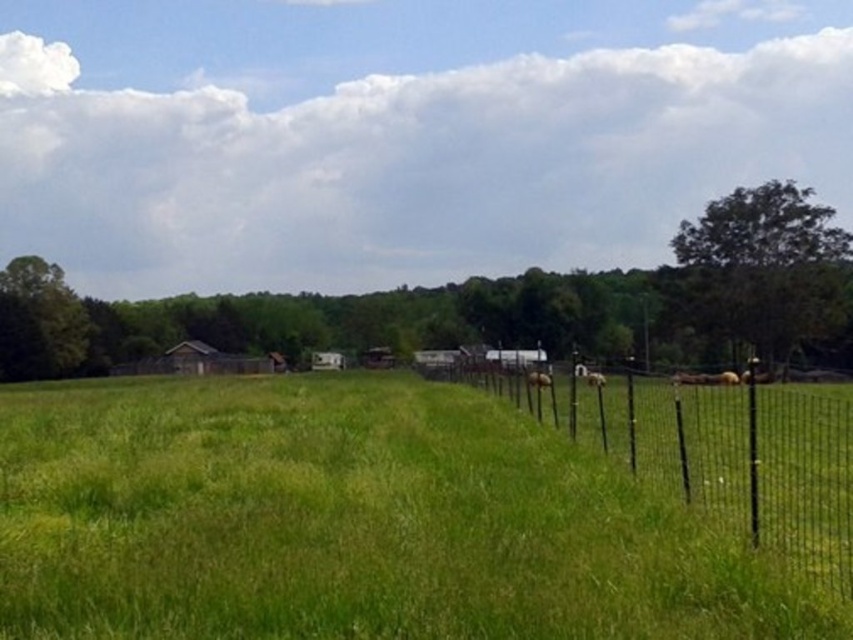
Question: Observing the image, what is the correct spatial positioning of green grassy field at center in reference to black wire fence at right?

Choices:
 (A) below
 (B) above

Answer: (A)

Question: Which object appears farthest from the camera in this image?

Choices:
 (A) green grassy field at center
 (B) black wire fence at right

Answer: (B)

Question: Estimate the real-world distances between objects in this image. Which object is farther from the green grassy field at center?

Choices:
 (A) black wire fence at right
 (B) brown furry dog at center

Answer: (B)

Question: Does black wire fence at right have a greater width compared to brown furry dog at center?

Choices:
 (A) no
 (B) yes

Answer: (B)

Question: Among these objects, which one is farthest from the camera?

Choices:
 (A) brown furry dog at center
 (B) green grassy field at center

Answer: (A)

Question: Is green grassy field at center bigger than black wire fence at right?

Choices:
 (A) no
 (B) yes

Answer: (A)